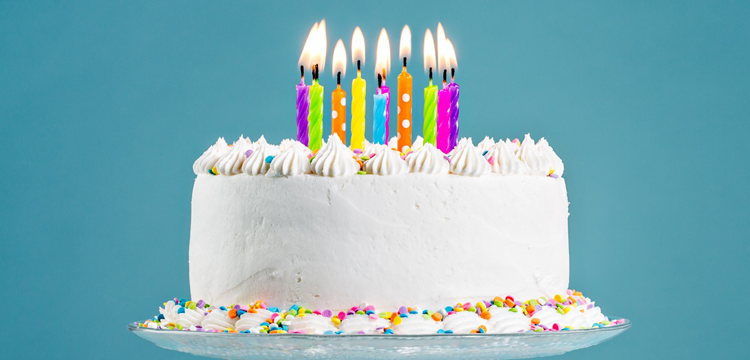
Find the location of a particular element. decor puffs is located at coordinates (201, 156), (238, 159), (254, 165), (284, 167), (339, 167), (396, 167), (423, 167), (478, 167), (493, 167), (552, 167).